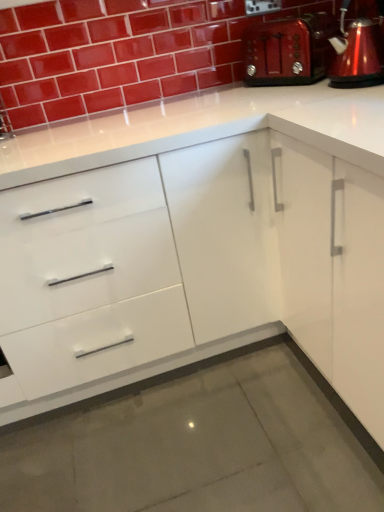
Measure the distance between metallic red coffeepot at upper right and camera.

metallic red coffeepot at upper right is 3.97 feet away from camera.

Locate an element on the screen. The width and height of the screenshot is (384, 512). metallic red toaster at upper right is located at coordinates (288, 50).

What are the coordinates of `metallic red coffeepot at upper right` in the screenshot? It's located at (358, 51).

Do you think metallic red toaster at upper right is within metallic red coffeepot at upper right, or outside of it?

metallic red toaster at upper right lies outside metallic red coffeepot at upper right.

Is metallic red toaster at upper right facing towards metallic red coffeepot at upper right?

No, metallic red toaster at upper right is not aimed at metallic red coffeepot at upper right.

Which object is positioned more to the right, metallic red toaster at upper right or metallic red coffeepot at upper right?

metallic red coffeepot at upper right.

From the picture: Considering the relative positions of metallic red coffeepot at upper right and white glossy cabinet at center in the image provided, is metallic red coffeepot at upper right to the left of white glossy cabinet at center from the viewer's perspective?

No, metallic red coffeepot at upper right is not to the left of white glossy cabinet at center.

Considering the sizes of metallic red coffeepot at upper right and white glossy cabinet at center in the image, is metallic red coffeepot at upper right wider or thinner than white glossy cabinet at center?

Considering their sizes, metallic red coffeepot at upper right looks slimmer than white glossy cabinet at center.

Is there a large distance between metallic red coffeepot at upper right and white glossy cabinet at center?

No, metallic red coffeepot at upper right is in close proximity to white glossy cabinet at center.

Who is bigger, glossy ceramic brick at upper center or metallic red coffeepot at upper right?

glossy ceramic brick at upper center.

At what (x,y) coordinates should I click in order to perform the action: click on brick above the metallic red coffeepot at upper right (from a real-world perspective). Please return your answer as a coordinate pair (x, y). The width and height of the screenshot is (384, 512). Looking at the image, I should click on (113, 54).

Is point (193, 51) closer or farther from the camera than point (376, 53)?

Point (193, 51) appears to be farther away from the viewer than point (376, 53).

Is glossy ceramic brick at upper center taller or shorter than metallic red coffeepot at upper right?

In the image, glossy ceramic brick at upper center appears to be taller than metallic red coffeepot at upper right.

Locate an element on the screen. The image size is (384, 512). cabinetry that appears below the metallic red toaster at upper right (from a real-world perspective) is located at coordinates (217, 241).

Which is in front, point (277, 73) or point (238, 192)?

The point (238, 192) is more forward.

From the picture: Considering the relative positions of metallic red toaster at upper right and white glossy cabinet at center in the image provided, is metallic red toaster at upper right behind white glossy cabinet at center?

Yes, metallic red toaster at upper right is behind white glossy cabinet at center.

Looking at this image, does metallic red toaster at upper right have a greater width compared to white glossy cabinet at center?

In fact, metallic red toaster at upper right might be narrower than white glossy cabinet at center.

Considering the relative sizes of metallic red coffeepot at upper right and metallic red toaster at upper right in the image provided, is metallic red coffeepot at upper right smaller than metallic red toaster at upper right?

Correct, metallic red coffeepot at upper right occupies less space than metallic red toaster at upper right.

From a real-world perspective, is metallic red coffeepot at upper right on top of metallic red toaster at upper right?

Correct, in the physical world, metallic red coffeepot at upper right is higher than metallic red toaster at upper right.

Which point is more distant from viewer, (x=381, y=62) or (x=272, y=83)?

Positioned behind is point (x=272, y=83).

Considering the relative positions of metallic red coffeepot at upper right and metallic red toaster at upper right in the image provided, is metallic red coffeepot at upper right in front of metallic red toaster at upper right?

Yes.

From the image's perspective, which is below, glossy ceramic brick at upper center or metallic red toaster at upper right?

metallic red toaster at upper right is shown below in the image.

Is glossy ceramic brick at upper center not within metallic red toaster at upper right?

Indeed, glossy ceramic brick at upper center is completely outside metallic red toaster at upper right.

Is point (92, 86) closer or farther from the camera than point (275, 38)?

Point (92, 86) is positioned closer to the camera compared to point (275, 38).

Which is farther, (217, 162) or (266, 28)?

The point (266, 28) is farther from the camera.

From the image's perspective, which object appears higher, white glossy cabinet at center or metallic red toaster at upper right?

metallic red toaster at upper right is shown above in the image.

Can you confirm if white glossy cabinet at center is bigger than metallic red toaster at upper right?

Correct, white glossy cabinet at center is larger in size than metallic red toaster at upper right.

Find the location of a particular element. This screenshot has width=384, height=512. appliance above the white glossy cabinet at center (from a real-world perspective) is located at coordinates click(288, 50).

The height and width of the screenshot is (512, 384). I want to click on coffeepot in front of the metallic red toaster at upper right, so click(x=358, y=51).

Locate an element on the screen. Image resolution: width=384 pixels, height=512 pixels. cabinetry beneath the metallic red coffeepot at upper right (from a real-world perspective) is located at coordinates (217, 241).

Estimate the real-world distances between objects in this image. Which object is closer to white glossy cabinet at center, metallic red toaster at upper right or glossy ceramic brick at upper center?

The object closer to white glossy cabinet at center is metallic red toaster at upper right.

Looking at the image, which one is located further to metallic red coffeepot at upper right, glossy ceramic brick at upper center or metallic red toaster at upper right?

glossy ceramic brick at upper center.

Estimate the real-world distances between objects in this image. Which object is closer to glossy ceramic brick at upper center, metallic red toaster at upper right or white glossy cabinet at center?

Based on the image, metallic red toaster at upper right appears to be nearer to glossy ceramic brick at upper center.

Looking at the image, which one is located closer to metallic red toaster at upper right, metallic red coffeepot at upper right or glossy ceramic brick at upper center?

metallic red coffeepot at upper right is positioned closer to the anchor metallic red toaster at upper right.

Based on their spatial positions, is metallic red toaster at upper right or metallic red coffeepot at upper right closer to glossy ceramic brick at upper center?

metallic red toaster at upper right is closer to glossy ceramic brick at upper center.

Based on their spatial positions, is glossy ceramic brick at upper center or metallic red toaster at upper right further from white glossy cabinet at center?

The object further to white glossy cabinet at center is glossy ceramic brick at upper center.

From the image, which object appears to be nearer to glossy ceramic brick at upper center, white glossy cabinet at center or metallic red coffeepot at upper right?

Based on the image, metallic red coffeepot at upper right appears to be nearer to glossy ceramic brick at upper center.

Looking at the image, which one is located further to glossy ceramic brick at upper center, white glossy cabinet at center or metallic red toaster at upper right?

white glossy cabinet at center lies further to glossy ceramic brick at upper center than the other object.

Where is `appliance situated between glossy ceramic brick at upper center and metallic red coffeepot at upper right from left to right`? appliance situated between glossy ceramic brick at upper center and metallic red coffeepot at upper right from left to right is located at coordinates (288, 50).

Locate an element on the screen. Image resolution: width=384 pixels, height=512 pixels. coffeepot that lies between glossy ceramic brick at upper center and white glossy cabinet at center from top to bottom is located at coordinates (358, 51).

Image resolution: width=384 pixels, height=512 pixels. I want to click on appliance between glossy ceramic brick at upper center and white glossy cabinet at center from top to bottom, so (288, 50).

Where is `coffeepot that lies between metallic red toaster at upper right and white glossy cabinet at center from top to bottom`? The width and height of the screenshot is (384, 512). coffeepot that lies between metallic red toaster at upper right and white glossy cabinet at center from top to bottom is located at coordinates (358, 51).